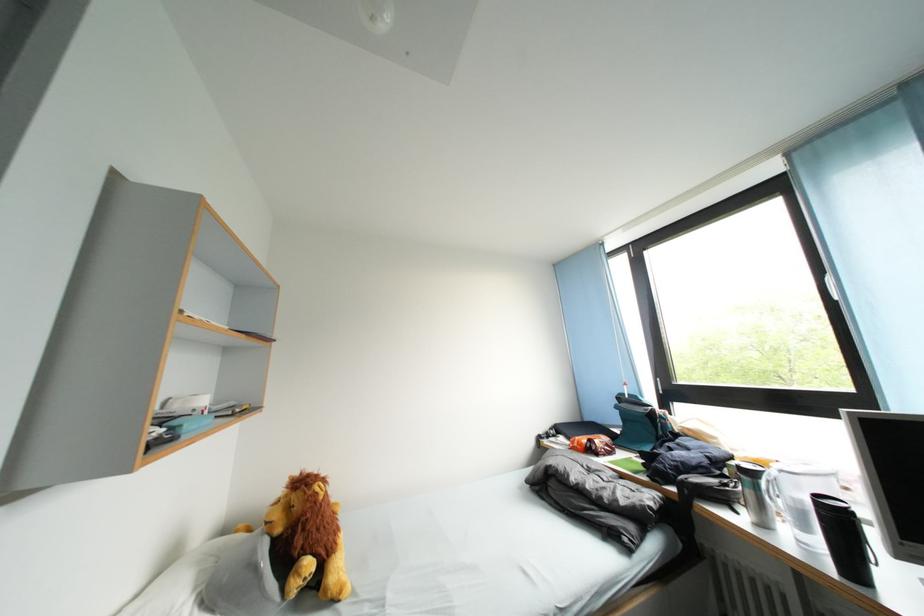
Where is `white pillow`? Image resolution: width=924 pixels, height=616 pixels. white pillow is located at coordinates (598, 485).